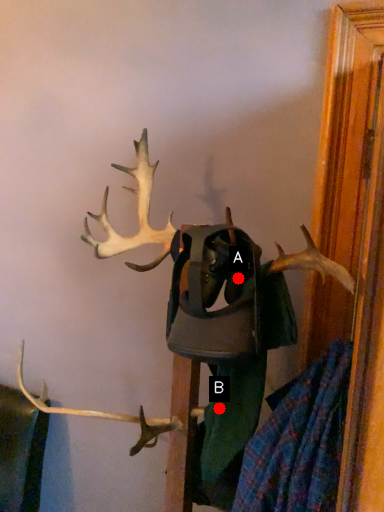
Question: Two points are circled on the image, labeled by A and B beside each circle. Which point is further to the camera?

Choices:
 (A) A is further
 (B) B is further

Answer: (B)